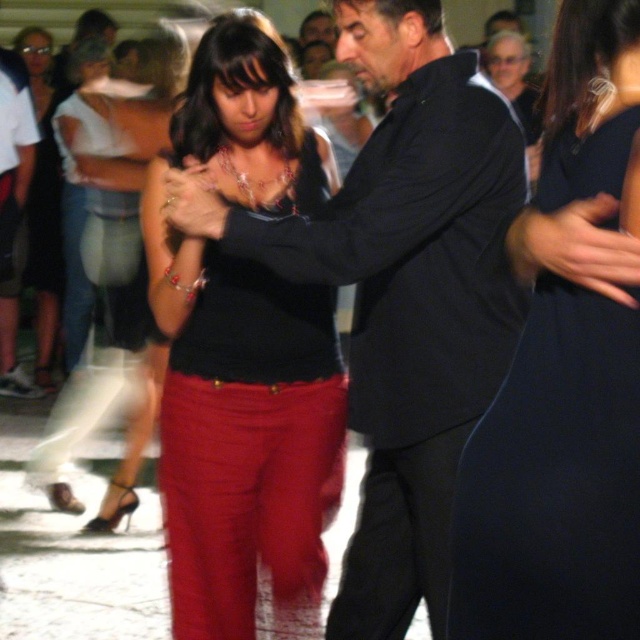
You are a photographer at the dance event and want to take a photo of the two dancers. The matte black suit at center and the matte black top at center are both in the frame. According to their positions, which one is on the right side?

The matte black suit at center is positioned on the right side of matte black top at center, so the matte black suit at center is on the right side.

You are a photographer at the event and want to capture a closeup of the black satin dress at center and the black smooth pants at center. Which one will appear larger in the photo?

The black satin dress at center will appear larger in the photo because it is closer to the viewer than the black smooth pants at center.

You are a photographer at the dance event. You need to capture a closeup shot of the two dancers. Given that the black satin dress at center is narrower than the black smooth pants at center, which object should you focus on to ensure the entire outfit is in frame without cropping?

The black satin dress at center is narrower than the black smooth pants at center, so focusing on the black satin dress at center would ensure the entire outfit is captured without cropping since it occupies less width.